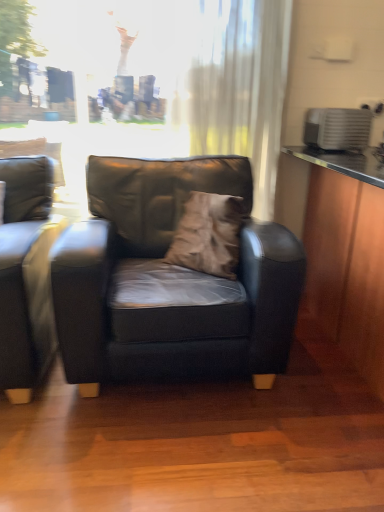
Where is `white sheer curtain at upper center`? Image resolution: width=384 pixels, height=512 pixels. white sheer curtain at upper center is located at coordinates (237, 86).

Locate an element on the screen. chair below the white sheer curtain at upper center (from the image's perspective) is located at coordinates (169, 280).

Is matte black chair at center facing towards white sheer curtain at upper center?

No.

From the image's perspective, is matte black chair at center located above or below white sheer curtain at upper center?

Clearly, from the image's perspective, matte black chair at center is below white sheer curtain at upper center.

How many degrees apart are the facing directions of matte black chair at center and white sheer curtain at upper center?

The angle between the facing direction of matte black chair at center and the facing direction of white sheer curtain at upper center is 5.68 degrees.

Find the location of a particular element. studio couch below the brown suede pillow at center (from the image's perspective) is located at coordinates tap(26, 274).

Is matte black couch at left at the back of brown suede pillow at center?

No.

Between point (200, 270) and point (10, 229), which one is positioned behind?

Positioned behind is point (200, 270).

From a real-world perspective, relative to matte black couch at left, is brown suede pillow at center vertically above or below?

In terms of real-world spatial position, brown suede pillow at center is above matte black couch at left.

Considering the positions of point (199, 254) and point (257, 106), is point (199, 254) closer or farther from the camera than point (257, 106)?

Point (199, 254) appears to be closer to the viewer than point (257, 106).

In terms of height, does brown suede pillow at center look taller or shorter compared to white sheer curtain at upper center?

Clearly, brown suede pillow at center is shorter compared to white sheer curtain at upper center.

How different are the orientations of brown suede pillow at center and white sheer curtain at upper center in degrees?

The facing directions of brown suede pillow at center and white sheer curtain at upper center are 57.4 degrees apart.

In the scene shown: Is brown suede pillow at center oriented towards white sheer curtain at upper center?

No, brown suede pillow at center is not aimed at white sheer curtain at upper center.

From the picture: From a real-world perspective, is matte black chair at center positioned above or below matte black couch at left?

Clearly, from a real-world perspective, matte black chair at center is below matte black couch at left.

From the image's perspective, between matte black chair at center and matte black couch at left, who is located below?

matte black couch at left appears lower in the image.

Are matte black chair at center and matte black couch at left located far from each other?

No, matte black chair at center is not far away from matte black couch at left.

Can you confirm if matte black chair at center is thinner than matte black couch at left?

Correct, the width of matte black chair at center is less than that of matte black couch at left.

Does white sheer curtain at upper center have a lesser height compared to brown suede pillow at center?

No, white sheer curtain at upper center is not shorter than brown suede pillow at center.

Is point (258, 81) positioned before point (218, 233)?

No, (258, 81) is further to viewer.

Is brown suede pillow at center at the back of white sheer curtain at upper center?

No.

Looking at this image, from the image's perspective, is matte black chair at center located beneath brown suede pillow at center?

Yes, from the image's perspective, matte black chair at center is below brown suede pillow at center.

Consider the image. Would you consider matte black chair at center to be distant from brown suede pillow at center?

matte black chair at center is near brown suede pillow at center, not far away.

In the scene shown: Which is closer to the camera, (x=180, y=193) or (x=197, y=238)?

Point (x=180, y=193).

Based on their positions, is matte black chair at center located to the left or right of brown suede pillow at center?

matte black chair at center is to the left of brown suede pillow at center.

Identify the location of studio couch below the brown suede pillow at center (from the image's perspective). The width and height of the screenshot is (384, 512). (26, 274).

Is matte black couch at left to the left or to the right of brown suede pillow at center in the image?

Based on their positions, matte black couch at left is located to the left of brown suede pillow at center.

Based on the photo, considering the sizes of matte black couch at left and brown suede pillow at center in the image, is matte black couch at left wider or thinner than brown suede pillow at center?

Clearly, matte black couch at left has more width compared to brown suede pillow at center.

Is matte black couch at left beside brown suede pillow at center?

matte black couch at left and brown suede pillow at center are clearly separated.

You are a GUI agent. You are given a task and a screenshot of the screen. Output one action in this format:
    pyautogui.click(x=<x>, y=<y>)
    Task: Click on the chair on the left of the white sheer curtain at upper center
    The height and width of the screenshot is (512, 384).
    Given the screenshot: What is the action you would take?
    pyautogui.click(x=169, y=280)

The width and height of the screenshot is (384, 512). Find the location of `pillow above the matte black couch at left (from the image's perspective)`. pillow above the matte black couch at left (from the image's perspective) is located at coordinates (208, 234).

Considering their positions, is matte black chair at center positioned closer to matte black couch at left than white sheer curtain at upper center?

Among the two, matte black chair at center is located nearer to matte black couch at left.

Based on their spatial positions, is matte black chair at center or brown suede pillow at center further from matte black couch at left?

brown suede pillow at center lies further to matte black couch at left than the other object.

Which object lies further to the anchor point matte black chair at center, white sheer curtain at upper center or matte black couch at left?

white sheer curtain at upper center.

Which object lies further to the anchor point brown suede pillow at center, matte black chair at center or matte black couch at left?

matte black couch at left.

Which object lies further to the anchor point brown suede pillow at center, white sheer curtain at upper center or matte black couch at left?

Among the two, white sheer curtain at upper center is located further to brown suede pillow at center.

From the image, which object appears to be nearer to brown suede pillow at center, matte black couch at left or white sheer curtain at upper center?

Among the two, matte black couch at left is located nearer to brown suede pillow at center.

Based on their spatial positions, is matte black chair at center or brown suede pillow at center closer to white sheer curtain at upper center?

brown suede pillow at center lies closer to white sheer curtain at upper center than the other object.

Which object lies further to the anchor point white sheer curtain at upper center, matte black couch at left or brown suede pillow at center?

matte black couch at left.

Find the location of a particular element. This screenshot has height=512, width=384. pillow located between matte black couch at left and white sheer curtain at upper center in the left-right direction is located at coordinates (208, 234).

The width and height of the screenshot is (384, 512). What are the coordinates of `pillow between white sheer curtain at upper center and matte black chair at center from top to bottom` in the screenshot? It's located at (208, 234).

Identify the location of chair between matte black couch at left and white sheer curtain at upper center in the horizontal direction. Image resolution: width=384 pixels, height=512 pixels. (169, 280).

I want to click on chair between matte black couch at left and brown suede pillow at center from left to right, so click(169, 280).